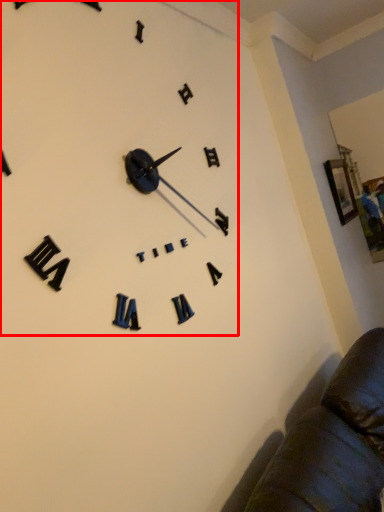
Question: From the image's perspective, where is clock (annotated by the red box) located in relation to picture frame in the image?

Choices:
 (A) above
 (B) below

Answer: (B)